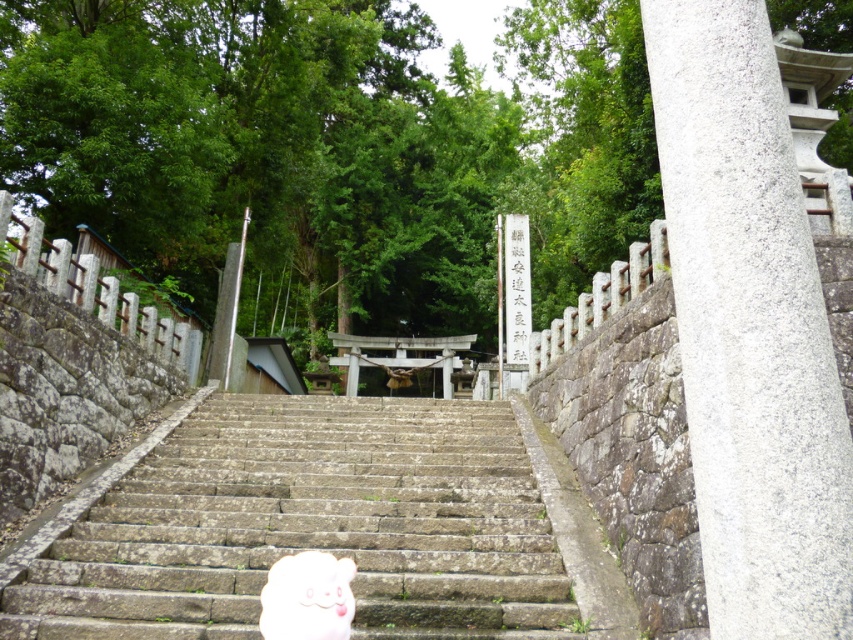
Question: Does stone stairs at center have a greater width compared to gray stone pillar at right?

Choices:
 (A) yes
 (B) no

Answer: (A)

Question: Can you confirm if stone stairs at center is positioned above white plush toy at center?

Choices:
 (A) no
 (B) yes

Answer: (A)

Question: Which object is positioned farthest from the stone stairs at center?

Choices:
 (A) white plush toy at center
 (B) gray stone pillar at right

Answer: (B)

Question: Is stone stairs at center below white plush toy at center?

Choices:
 (A) no
 (B) yes

Answer: (B)

Question: Considering the real-world distances, which object is farthest from the gray stone pillar at right?

Choices:
 (A) white plush toy at center
 (B) stone stairs at center

Answer: (B)

Question: Which of these objects is positioned closest to the gray stone pillar at right?

Choices:
 (A) white plush toy at center
 (B) stone stairs at center

Answer: (A)